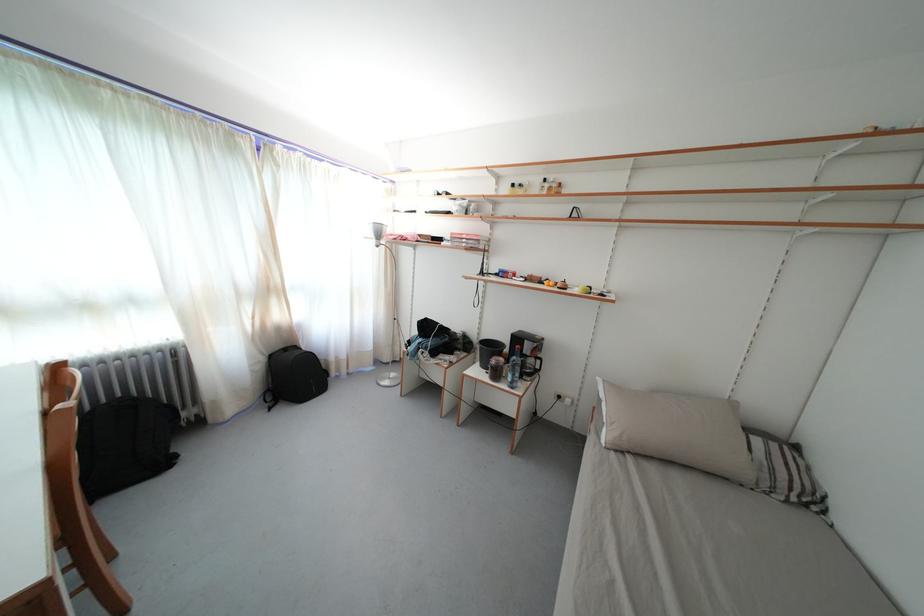
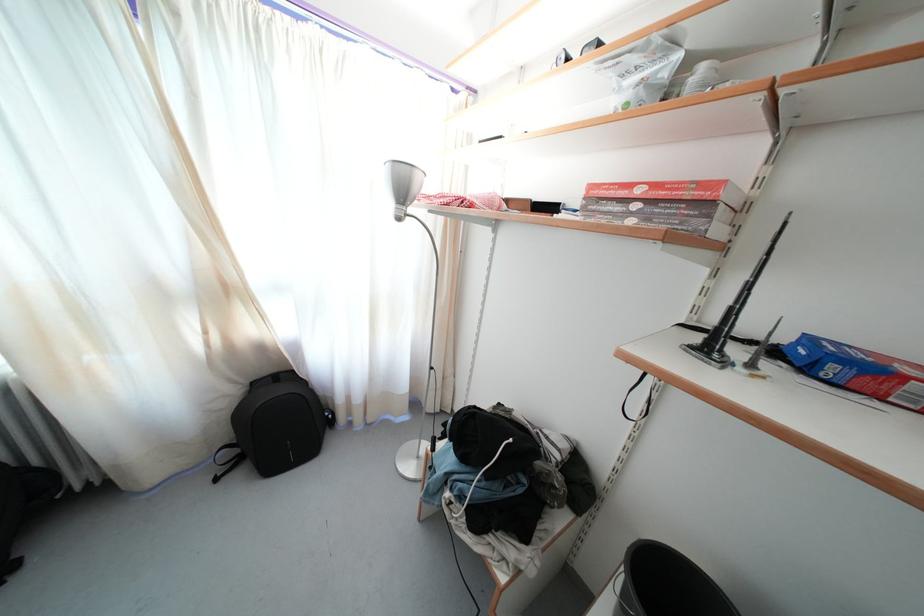
Question: The images are taken continuously from a first-person perspective. In which direction are you moving?

Choices:
 (A) Left
 (B) Right
 (C) Forward
 (D) Backward

Answer: (C)